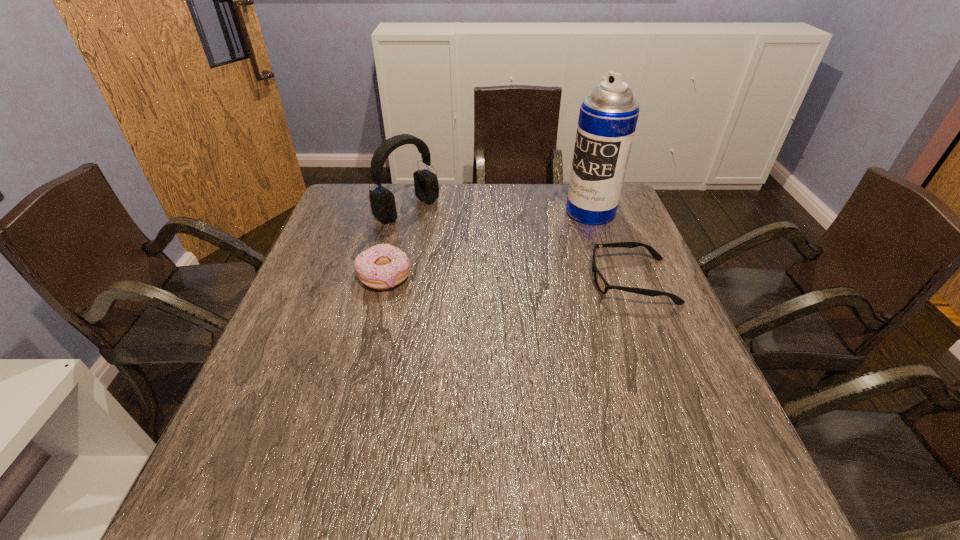
The image size is (960, 540). I want to click on vacant position located on the headband of the third shortest object, so click(x=521, y=283).

Identify the location of vacant space located on the label side of the aerosol can. The height and width of the screenshot is (540, 960). (559, 232).

Identify the location of free space located on the label side of the aerosol can. This screenshot has height=540, width=960. (533, 247).

Locate an element on the screen. The width and height of the screenshot is (960, 540). free location located on the label side of the aerosol can is located at coordinates (506, 265).

This screenshot has height=540, width=960. I want to click on headset present at the far edge, so click(x=382, y=200).

At what (x,y) coordinates should I click in order to perform the action: click on aerosol can that is positioned at the far edge. Please return your answer as a coordinate pair (x, y). This screenshot has width=960, height=540. Looking at the image, I should click on (608, 116).

Where is `doughnut that is at the left edge`? doughnut that is at the left edge is located at coordinates (383, 266).

Locate an element on the screen. headset that is at the left edge is located at coordinates (382, 200).

Identify the location of spectacles located at the right edge. (602, 285).

Find the location of `aerosol can present at the right edge`. aerosol can present at the right edge is located at coordinates (608, 116).